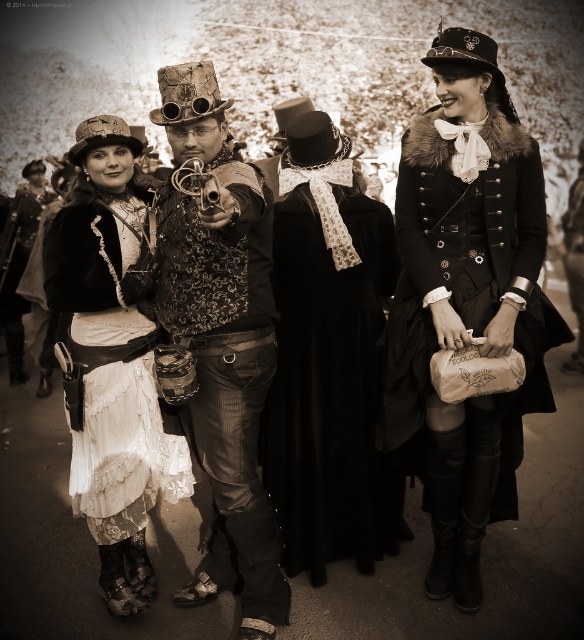
Does black velvet dress at center have a lesser width compared to steampunk attire at center?

No, black velvet dress at center is not thinner than steampunk attire at center.

Between black velvet dress at center and steampunk attire at center, which one is positioned higher?

Positioned higher is black velvet dress at center.

Does point (319, 172) lie in front of point (201, 564)?

No, it is behind (201, 564).

The height and width of the screenshot is (640, 584). Identify the location of black velvet dress at center. (328, 353).

What do you see at coordinates (328, 353) in the screenshot? I see `black velvet dress at center` at bounding box center [328, 353].

Between black velvet dress at center and white lace dress at center, which one is positioned lower?

white lace dress at center is below.

Where is `black velvet dress at center`? black velvet dress at center is located at coordinates (328, 353).

Can you confirm if white lace dress at center is shorter than matte black vest at center?

Yes, white lace dress at center is shorter than matte black vest at center.

Is point (119, 378) positioned before point (19, 273)?

Yes, point (119, 378) is in front of point (19, 273).

Find the location of a particular element. This screenshot has height=640, width=584. white lace dress at center is located at coordinates (112, 362).

Locate an element on the screen. white lace dress at center is located at coordinates (x=112, y=362).